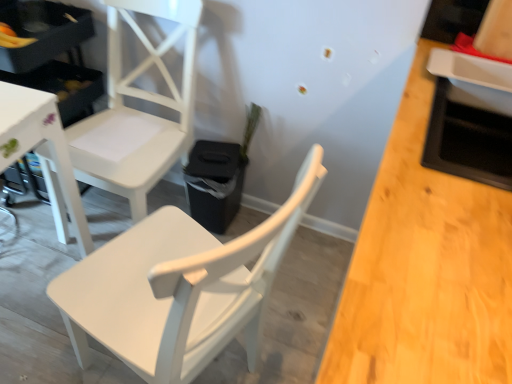
Question: Is white matte chair at center, the second chair when ordered from back to front, wider or thinner than white matte chair at upper left, the second chair in the front-to-back sequence?

Choices:
 (A) thin
 (B) wide

Answer: (B)

Question: Is white matte chair at center, the 1th chair viewed from the front, in front of or behind white matte chair at upper left, which ranks as the 1th chair in back-to-front order, in the image?

Choices:
 (A) front
 (B) behind

Answer: (A)

Question: Considering the positions of point (297, 211) and point (170, 132), is point (297, 211) closer or farther from the camera than point (170, 132)?

Choices:
 (A) closer
 (B) farther

Answer: (A)

Question: Which is correct: white matte chair at upper left, which ranks as the 1th chair in back-to-front order, is inside white matte chair at center, the second chair when ordered from back to front, or outside of it?

Choices:
 (A) inside
 (B) outside

Answer: (B)

Question: Is white matte chair at upper left, which ranks as the 1th chair in back-to-front order, in front of or behind white matte chair at center, the second chair when ordered from back to front, in the image?

Choices:
 (A) front
 (B) behind

Answer: (B)

Question: From the image's perspective, is white matte chair at upper left, which ranks as the 1th chair in back-to-front order, above or below white matte chair at center, the second chair when ordered from back to front?

Choices:
 (A) above
 (B) below

Answer: (A)

Question: Looking at the image, does white matte chair at upper left, which ranks as the 1th chair in back-to-front order, seem bigger or smaller compared to white matte chair at center, the second chair when ordered from back to front?

Choices:
 (A) big
 (B) small

Answer: (B)